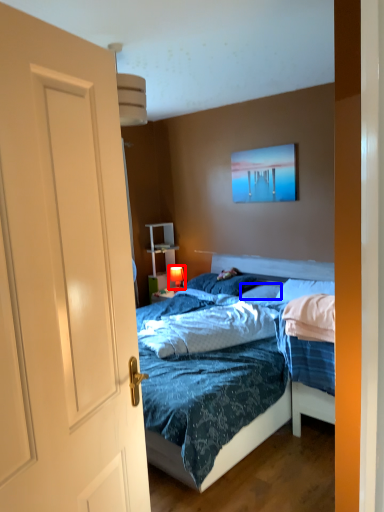
Question: Which object is further to the camera taking this photo, lamp (highlighted by a red box) or pillow (highlighted by a blue box)?

Choices:
 (A) lamp
 (B) pillow

Answer: (A)